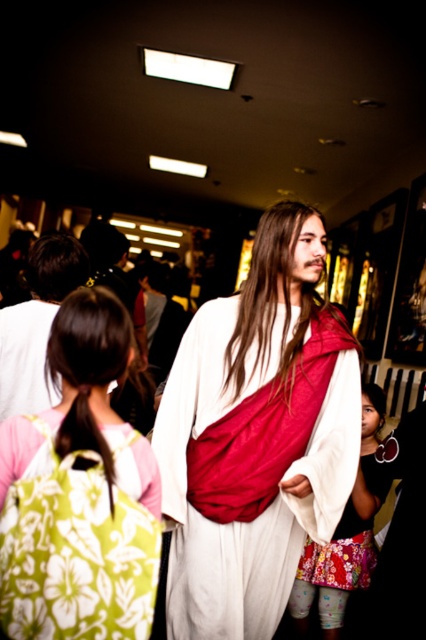
Question: Is white matte dress at center wider than floral fabric skirt at lower center?

Choices:
 (A) yes
 (B) no

Answer: (A)

Question: Which of the following is the closest to the observer?

Choices:
 (A) (57, 458)
 (B) (28, 262)
 (C) (368, 470)
 (D) (322, 317)

Answer: (A)

Question: Which of the following is the closest to the observer?

Choices:
 (A) floral fabric skirt at lower center
 (B) green floral backpack at lower left

Answer: (B)

Question: Is green floral backpack at lower left to the left of floral fabric skirt at lower center from the viewer's perspective?

Choices:
 (A) no
 (B) yes

Answer: (B)

Question: Is white matte dress at center closer to the viewer compared to white cloth at center?

Choices:
 (A) yes
 (B) no

Answer: (B)

Question: Which point is farther from the camera taking this photo?

Choices:
 (A) (370, 496)
 (B) (275, 509)
 (C) (81, 326)
 (D) (26, 412)

Answer: (A)